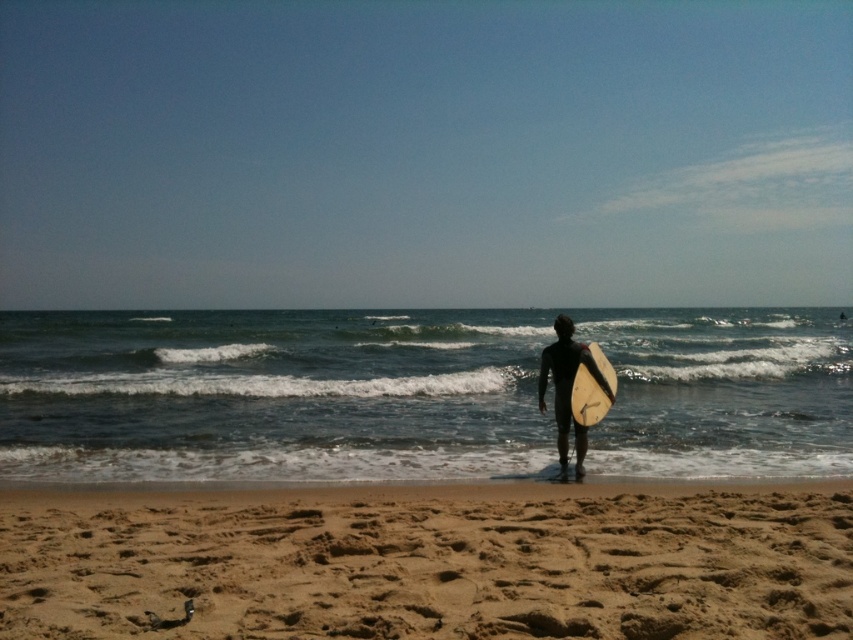
Question: Does fine-grained sand at lower center appear on the right side of white foam surfboard at center?

Choices:
 (A) no
 (B) yes

Answer: (A)

Question: Which object appears closest to the camera in this image?

Choices:
 (A) fine-grained sand at lower center
 (B) dark blue water at center

Answer: (A)

Question: From the image, what is the correct spatial relationship of dark blue water at center in relation to fine-grained sand at lower center?

Choices:
 (A) right
 (B) left

Answer: (A)

Question: Which point appears closest to the camera in this image?

Choices:
 (A) 578,378
 (B) 83,618
 (C) 283,451

Answer: (B)

Question: Is dark blue water at center to the left of fine-grained sand at lower center from the viewer's perspective?

Choices:
 (A) yes
 (B) no

Answer: (B)

Question: Which object is closer to the camera taking this photo?

Choices:
 (A) white foam surfboard at center
 (B) fine-grained sand at lower center

Answer: (B)